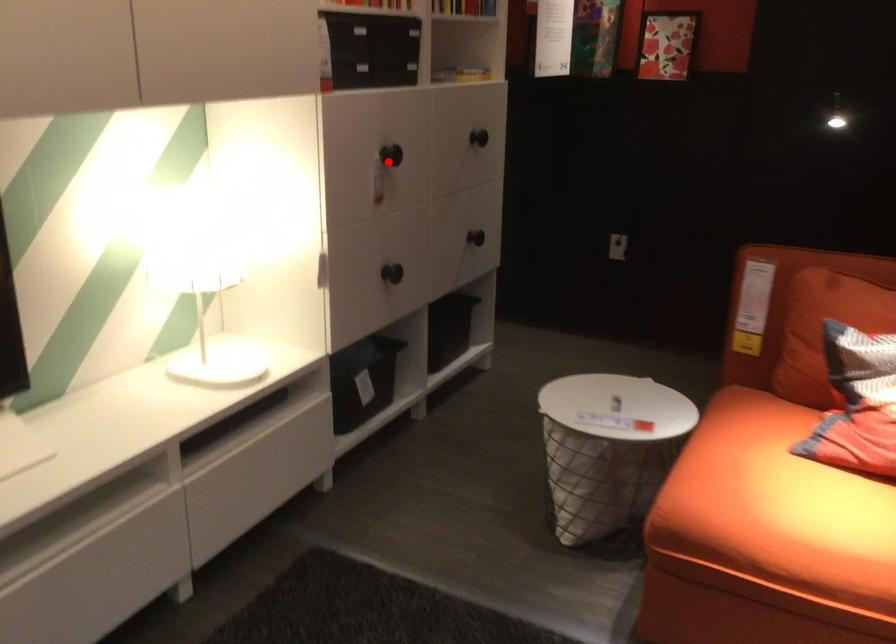
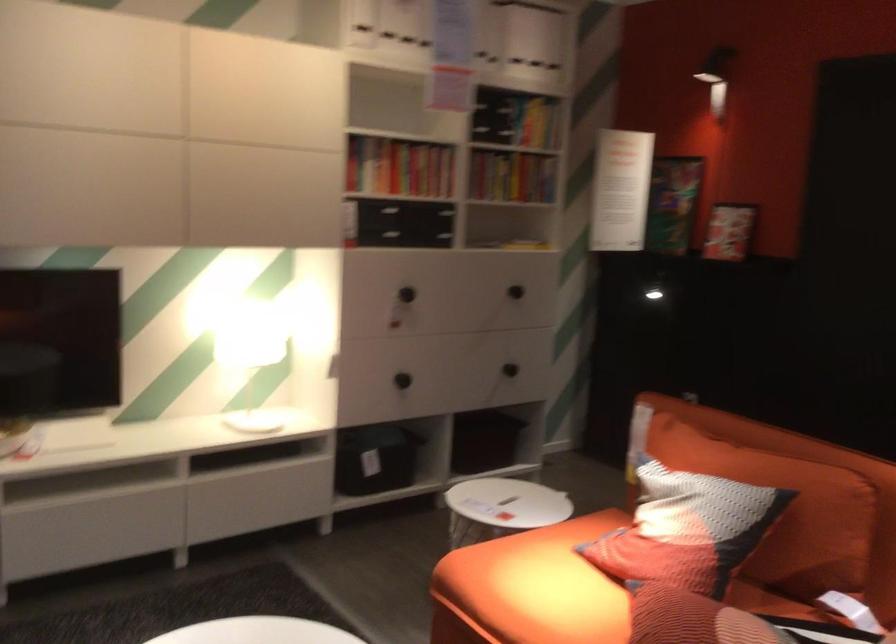
Find the pixel in the second image that matches the highlighted location in the first image.

(407, 294)